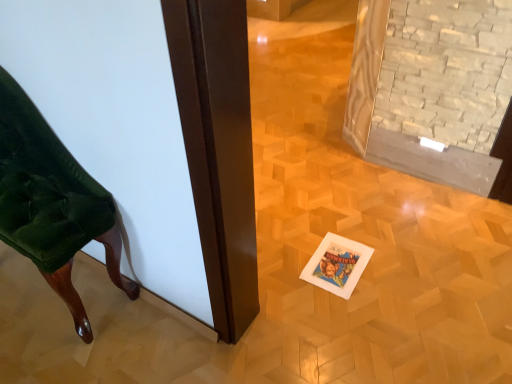
You are a GUI agent. You are given a task and a screenshot of the screen. Output one action in this format:
    pyautogui.click(x=<x>, y=<y>)
    Task: Click on the white paper postcard at center
    
    Given the screenshot: What is the action you would take?
    pyautogui.click(x=337, y=265)

The image size is (512, 384). What do you see at coordinates (337, 265) in the screenshot?
I see `white paper postcard at center` at bounding box center [337, 265].

What is the approximate width of velvet green chair at left?

11.17 inches.

Describe the element at coordinates (52, 202) in the screenshot. I see `velvet green chair at left` at that location.

Find the location of a particular element. Image resolution: width=512 pixels, height=384 pixels. velvet green chair at left is located at coordinates (52, 202).

You are a GUI agent. You are given a task and a screenshot of the screen. Output one action in this format:
    pyautogui.click(x=<x>, y=<y>)
    Task: Click on the white paper postcard at center
    This screenshot has height=384, width=512.
    Given the screenshot: What is the action you would take?
    pyautogui.click(x=337, y=265)

Which is more to the right, velvet green chair at left or white paper postcard at center?

white paper postcard at center.

Between velvet green chair at left and white paper postcard at center, which one is positioned in front?

velvet green chair at left is in front.

Does point (37, 158) lie in front of point (351, 287)?

Yes.

From the image's perspective, would you say velvet green chair at left is shown under white paper postcard at center?

No.

From a real-world perspective, relative to white paper postcard at center, is velvet green chair at left vertically above or below?

velvet green chair at left is above white paper postcard at center.

Considering the relative sizes of velvet green chair at left and white paper postcard at center in the image provided, is velvet green chair at left thinner than white paper postcard at center?

Yes.

Considering the sizes of velvet green chair at left and white paper postcard at center in the image, is velvet green chair at left taller or shorter than white paper postcard at center?

Considering their sizes, velvet green chair at left has more height than white paper postcard at center.

In terms of size, does velvet green chair at left appear bigger or smaller than white paper postcard at center?

In the image, velvet green chair at left appears to be larger than white paper postcard at center.

Is velvet green chair at left located outside white paper postcard at center?

Yes.

Consider the image. Is there a large distance between velvet green chair at left and white paper postcard at center?

velvet green chair at left is near white paper postcard at center, not far away.

Is velvet green chair at left looking in the opposite direction of white paper postcard at center?

velvet green chair at left is not turned away from white paper postcard at center.

How many degrees apart are the facing directions of velvet green chair at left and white paper postcard at center?

They differ by 0.698 degrees in their facing directions.

Measure the distance from velvet green chair at left to white paper postcard at center.

velvet green chair at left and white paper postcard at center are 90.61 centimeters apart.

Where is `postcard on the right of velvet green chair at left`? The height and width of the screenshot is (384, 512). postcard on the right of velvet green chair at left is located at coordinates (337, 265).

Between white paper postcard at center and velvet green chair at left, which one appears on the right side from the viewer's perspective?

Positioned to the right is white paper postcard at center.

Considering their positions, is white paper postcard at center located in front of or behind velvet green chair at left?

In the image, white paper postcard at center appears behind velvet green chair at left.

Is point (367, 258) positioned behind point (20, 244)?

Yes.

From the image's perspective, which is above, white paper postcard at center or velvet green chair at left?

From the image's view, velvet green chair at left is above.

In the scene shown: From a real-world perspective, between white paper postcard at center and velvet green chair at left, who is vertically lower?

In real-world perspective, white paper postcard at center is lower.

Does white paper postcard at center have a greater width compared to velvet green chair at left?

Yes.

Considering the sizes of objects white paper postcard at center and velvet green chair at left in the image provided, who is taller, white paper postcard at center or velvet green chair at left?

velvet green chair at left.

Which of these two, white paper postcard at center or velvet green chair at left, is smaller?

Smaller between the two is white paper postcard at center.

Is white paper postcard at center positioned beyond the bounds of velvet green chair at left?

Yes, white paper postcard at center is located beyond the bounds of velvet green chair at left.

Is white paper postcard at center with velvet green chair at left?

No, white paper postcard at center is not in contact with velvet green chair at left.

Is white paper postcard at center positioned with its back to velvet green chair at left?

No, white paper postcard at center is not facing the opposite direction of velvet green chair at left.

Can you tell me how much white paper postcard at center and velvet green chair at left differ in facing direction?

0.698 degrees separate the facing orientations of white paper postcard at center and velvet green chair at left.

How much distance is there between white paper postcard at center and velvet green chair at left?

They are 90.61 centimeters apart.

Identify the location of postcard beneath the velvet green chair at left (from a real-world perspective). (337, 265).

Identify the location of postcard that is under the velvet green chair at left (from a real-world perspective). (337, 265).

Find the location of `postcard on the right of velvet green chair at left`. postcard on the right of velvet green chair at left is located at coordinates click(x=337, y=265).